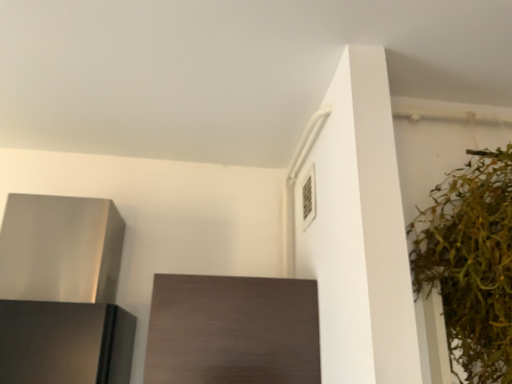
Question: From a real-world perspective, relative to dark wood cabinet at center, is green leafy plant at right vertically above or below?

Choices:
 (A) below
 (B) above

Answer: (B)

Question: Do you think green leafy plant at right is within dark wood cabinet at center, or outside of it?

Choices:
 (A) outside
 (B) inside

Answer: (A)

Question: Which of these objects is positioned closest to the dark wood cabinet at center?

Choices:
 (A) green leafy plant at right
 (B) satin silver range hood at left

Answer: (B)

Question: Considering the real-world distances, which object is farthest from the dark wood cabinet at center?

Choices:
 (A) green leafy plant at right
 (B) satin silver range hood at left

Answer: (A)